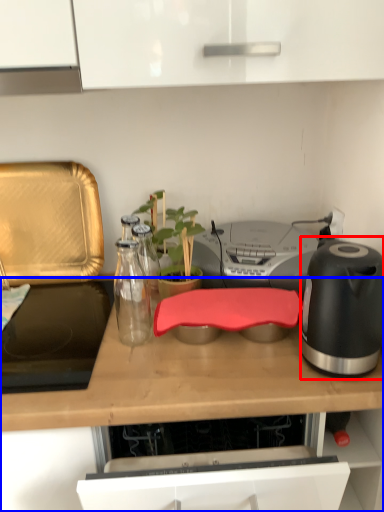
Question: Which object is further to the camera taking this photo, kitchen appliance (highlighted by a red box) or countertop (highlighted by a blue box)?

Choices:
 (A) kitchen appliance
 (B) countertop

Answer: (A)